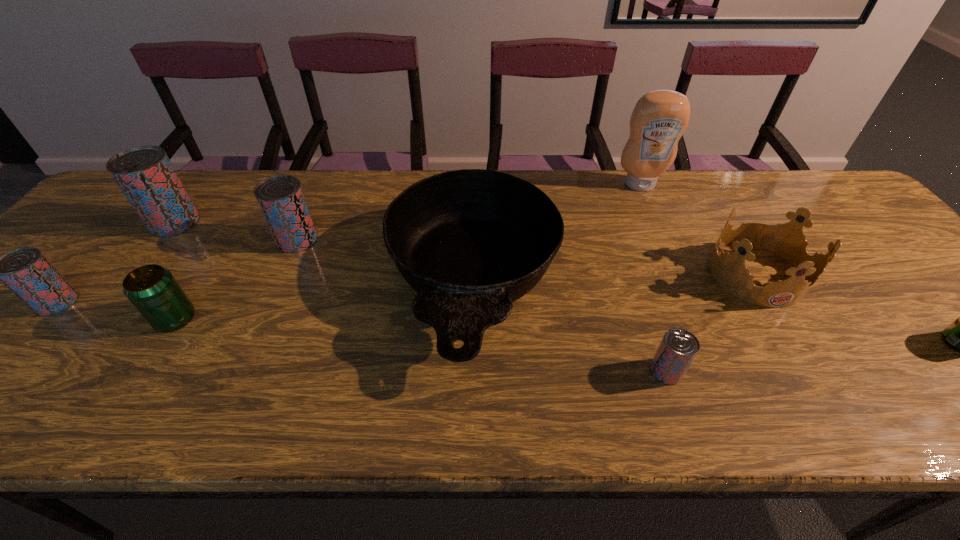
The width and height of the screenshot is (960, 540). What are the coordinates of `the tallest object` in the screenshot? It's located at (659, 119).

I want to click on condiment, so click(659, 119).

Find the location of `the tallest beer can`. the tallest beer can is located at coordinates (145, 175).

In order to click on the second object from left to right in this screenshot , I will do `click(145, 175)`.

Identify the location of the fourth beer can from left to right. This screenshot has height=540, width=960. (281, 199).

You are a GUI agent. You are given a task and a screenshot of the screen. Output one action in this format:
    pyautogui.click(x=<x>, y=<y>)
    Task: Click on the second tallest beer can
    This screenshot has width=960, height=540.
    Given the screenshot: What is the action you would take?
    pyautogui.click(x=281, y=199)

Find the location of a particular element. The image size is (960, 540). tiara is located at coordinates (787, 240).

At what (x,y) coordinates should I click in order to perform the action: click on the fifth object from left to right. Please return your answer as a coordinate pair (x, y). Looking at the image, I should click on (470, 242).

The height and width of the screenshot is (540, 960). Find the location of `frying pan`. frying pan is located at coordinates pyautogui.click(x=470, y=242).

This screenshot has width=960, height=540. I want to click on the leftmost object, so click(25, 271).